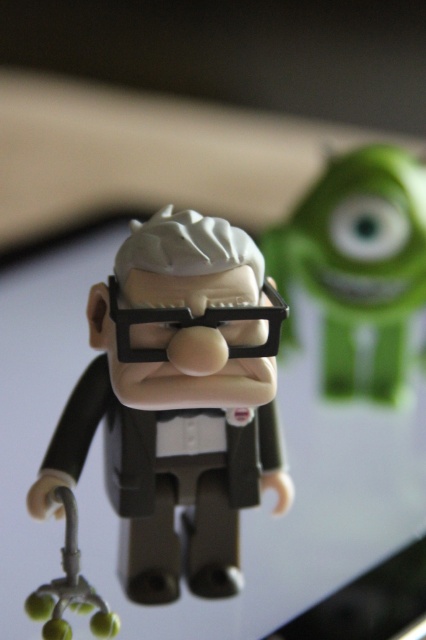
You are a photographer trying to capture the exact location of the point at coordinates (176, 403) in the image. Based on the scene, where would this point be located?

The point at coordinates (176, 403) is on the matte black figure at center.

You are a toy collector who wants to place the matte black figure at center and the green matte mike wazowski at upper right on a shelf. The shelf has a maximum width of 40 centimeters. Can both items fit side by side on the shelf without overlapping?

The distance between the matte black figure at center and green matte mike wazowski at upper right is 38.55 centimeters, which is less than the shelf width of 40 centimeters. Therefore, both items can fit side by side on the shelf without overlapping.